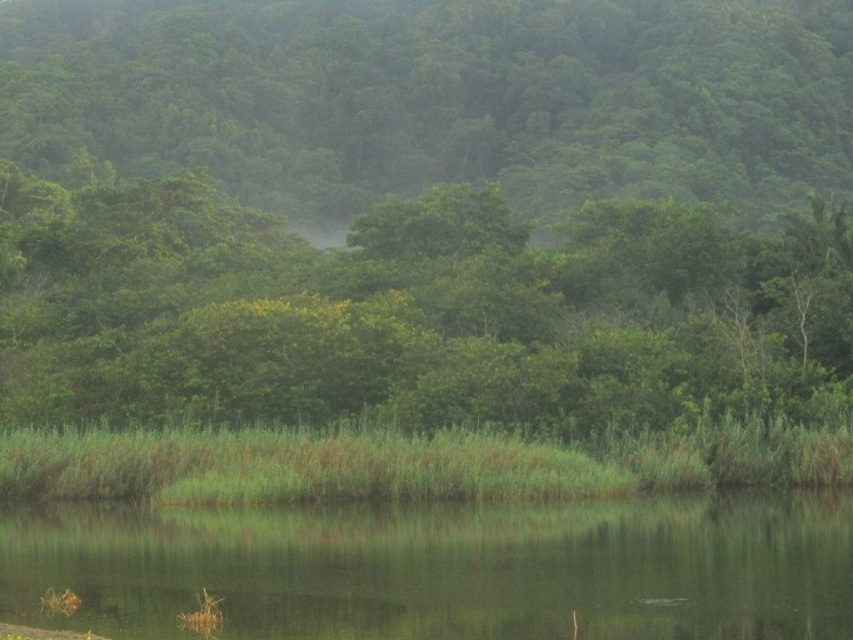
Does green leafy tree at center appear under green smooth water at lower center?

No.

Measure the distance between green leafy tree at center and green smooth water at lower center.

green leafy tree at center and green smooth water at lower center are 46.69 meters apart from each other.

The height and width of the screenshot is (640, 853). I want to click on green leafy tree at center, so click(x=424, y=209).